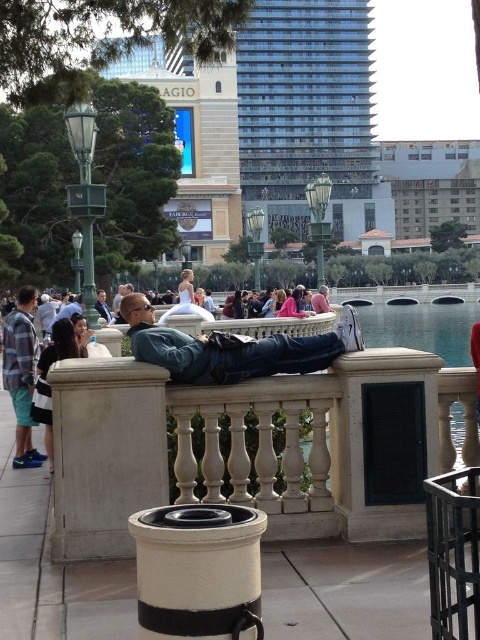
You are a photographer trying to capture both the denim jacket at center and the plaid flannel shirt at left in a single shot. Based on their positions, which one should you focus on first to ensure both are in frame?

The denim jacket at center is to the right of the plaid flannel shirt at left, so you should focus on the plaid flannel shirt at left first to ensure both are in frame.

You are standing at the entrance of the park and want to find the denim jacket at center. According to the coordinates provided, in which direction should you move relative to your current position?

The denim jacket at center is located at point 0.545 on the x and y axis. Since the coordinates are in the center, you should move towards the middle of the park to find it.